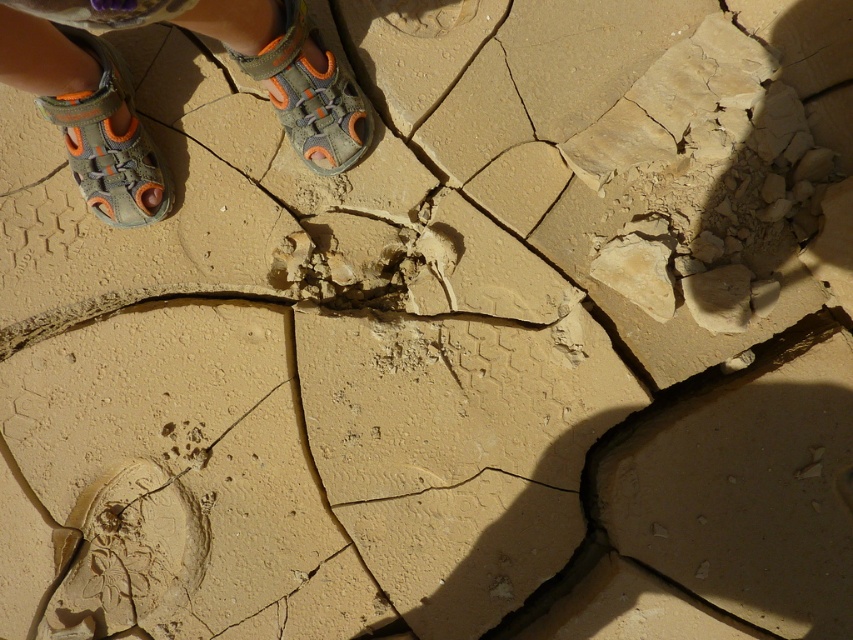
Question: Does gray fabric sandal at left have a greater width compared to gray fabric sandal at upper center?

Choices:
 (A) yes
 (B) no

Answer: (B)

Question: Which of these objects is positioned farthest from the gray fabric sandals at upper left?

Choices:
 (A) gray fabric sandal at left
 (B) gray fabric sandal at upper center

Answer: (B)

Question: Is gray fabric sandals at upper left positioned behind gray fabric sandal at left?

Choices:
 (A) no
 (B) yes

Answer: (A)

Question: Which of the following is the farthest from the observer?

Choices:
 (A) gray fabric sandal at left
 (B) gray fabric sandal at upper center

Answer: (B)

Question: Which point is closer to the camera taking this photo?

Choices:
 (A) (300, 3)
 (B) (120, 88)

Answer: (A)

Question: Is gray fabric sandals at upper left positioned at the back of gray fabric sandal at left?

Choices:
 (A) no
 (B) yes

Answer: (A)